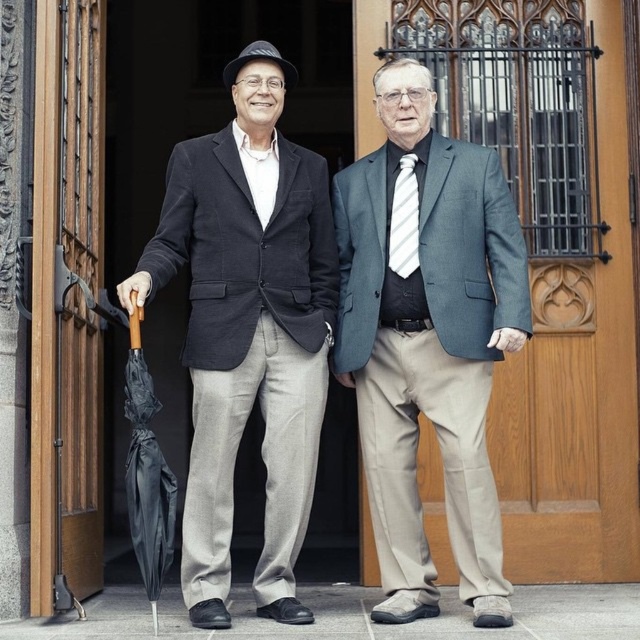
Question: Which object is positioned farthest from the white striped tie at center?

Choices:
 (A) wooden door at left
 (B) black matte umbrella at left

Answer: (A)

Question: Does matte black suit at center lie behind black matte umbrella at left?

Choices:
 (A) yes
 (B) no

Answer: (A)

Question: Estimate the real-world distances between objects in this image. Which object is farther from the matte black suit at center?

Choices:
 (A) black matte umbrella at left
 (B) white striped tie at center
 (C) dark gray wool blazer at left
 (D) wooden door at left

Answer: (D)

Question: Can you confirm if matte gray suit at center is smaller than wooden door at left?

Choices:
 (A) yes
 (B) no

Answer: (B)

Question: Which point is closer to the camera?

Choices:
 (A) (493, 173)
 (B) (54, 346)
 (C) (189, 460)
 (D) (404, 428)

Answer: (B)

Question: Is dark gray wool blazer at left closer to the viewer compared to black matte umbrella at left?

Choices:
 (A) yes
 (B) no

Answer: (B)